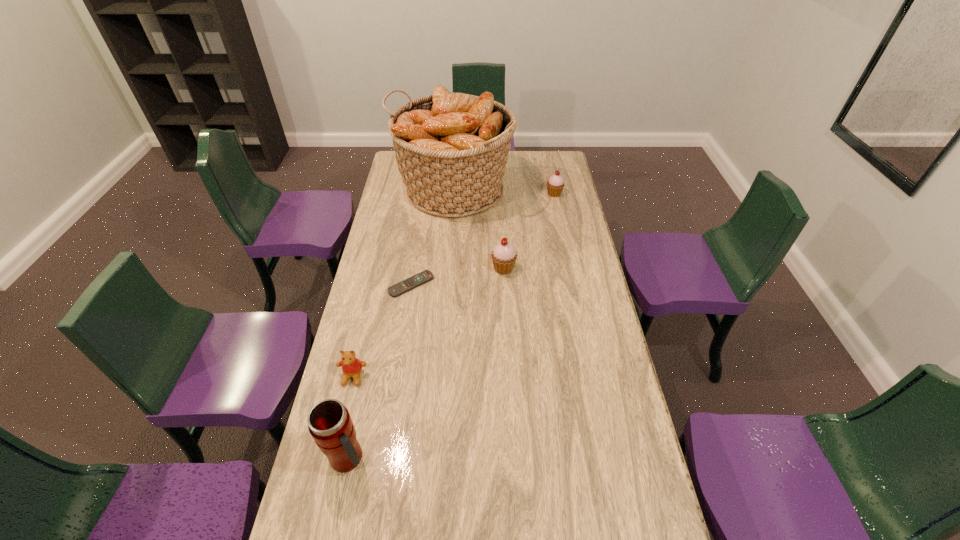
Identify the location of the fourth shortest object. (504, 256).

This screenshot has width=960, height=540. Find the location of `the taller cupcake`. the taller cupcake is located at coordinates (504, 256).

This screenshot has height=540, width=960. Identify the location of the shorter cupcake. (555, 184).

I want to click on the farther cupcake, so click(555, 184).

Identify the location of the shortest object. This screenshot has width=960, height=540. (412, 282).

At what (x,y) coordinates should I click in order to perform the action: click on basket. Please return your answer as a coordinate pair (x, y). Image resolution: width=960 pixels, height=540 pixels. Looking at the image, I should click on (451, 149).

You are a GUI agent. You are given a task and a screenshot of the screen. Output one action in this format:
    pyautogui.click(x=<x>, y=<y>)
    Task: Click on the thermos bottle
    Image resolution: width=960 pixels, height=540 pixels.
    Given the screenshot: What is the action you would take?
    pyautogui.click(x=329, y=422)

The height and width of the screenshot is (540, 960). What are the coordinates of `the nearest object` in the screenshot? It's located at (329, 422).

You are a GUI agent. You are given a task and a screenshot of the screen. Output one action in this format:
    pyautogui.click(x=<x>, y=<y>)
    Task: Click on the teddy bear
    This screenshot has height=540, width=960.
    Given the screenshot: What is the action you would take?
    pyautogui.click(x=351, y=366)

Find the location of a particular element. This screenshot has width=960, height=540. vacant space situated on the front of the left cupcake is located at coordinates (505, 299).